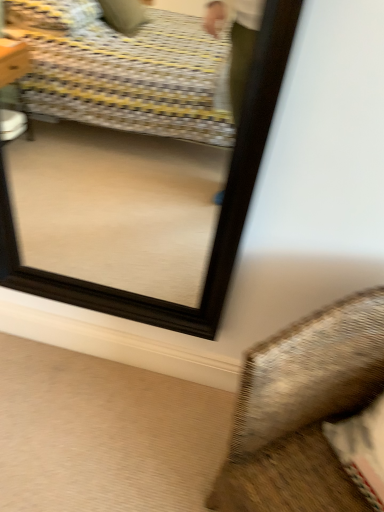
Question: Is textured fabric pillow at lower right at the right side of black wooden mirror at upper center?

Choices:
 (A) yes
 (B) no

Answer: (A)

Question: Is textured fabric pillow at lower right wider than black wooden mirror at upper center?

Choices:
 (A) no
 (B) yes

Answer: (B)

Question: Is textured fabric pillow at lower right further to camera compared to black wooden mirror at upper center?

Choices:
 (A) no
 (B) yes

Answer: (A)

Question: Is textured fabric pillow at lower right located outside black wooden mirror at upper center?

Choices:
 (A) yes
 (B) no

Answer: (A)

Question: Can you confirm if textured fabric pillow at lower right is bigger than black wooden mirror at upper center?

Choices:
 (A) yes
 (B) no

Answer: (A)

Question: Does textured fabric pillow at lower right have a lesser width compared to black wooden mirror at upper center?

Choices:
 (A) yes
 (B) no

Answer: (B)

Question: From the image's perspective, is black wooden mirror at upper center located above textured fabric pillow at lower right?

Choices:
 (A) no
 (B) yes

Answer: (B)

Question: Considering the relative sizes of black wooden mirror at upper center and textured fabric pillow at lower right in the image provided, is black wooden mirror at upper center wider than textured fabric pillow at lower right?

Choices:
 (A) yes
 (B) no

Answer: (B)

Question: From a real-world perspective, is black wooden mirror at upper center physically above textured fabric pillow at lower right?

Choices:
 (A) no
 (B) yes

Answer: (B)

Question: Could you tell me if black wooden mirror at upper center is facing textured fabric pillow at lower right?

Choices:
 (A) no
 (B) yes

Answer: (A)

Question: Can you confirm if black wooden mirror at upper center is smaller than textured fabric pillow at lower right?

Choices:
 (A) yes
 (B) no

Answer: (A)

Question: Considering the relative positions of black wooden mirror at upper center and textured fabric pillow at lower right in the image provided, is black wooden mirror at upper center behind textured fabric pillow at lower right?

Choices:
 (A) no
 (B) yes

Answer: (B)

Question: From a real-world perspective, is textured fabric pillow at lower right above or below black wooden mirror at upper center?

Choices:
 (A) above
 (B) below

Answer: (B)